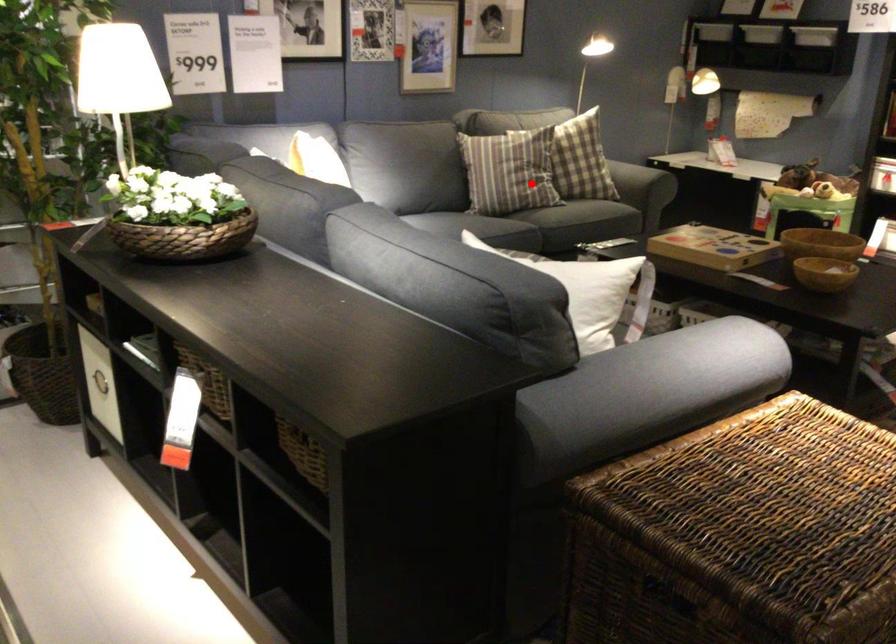
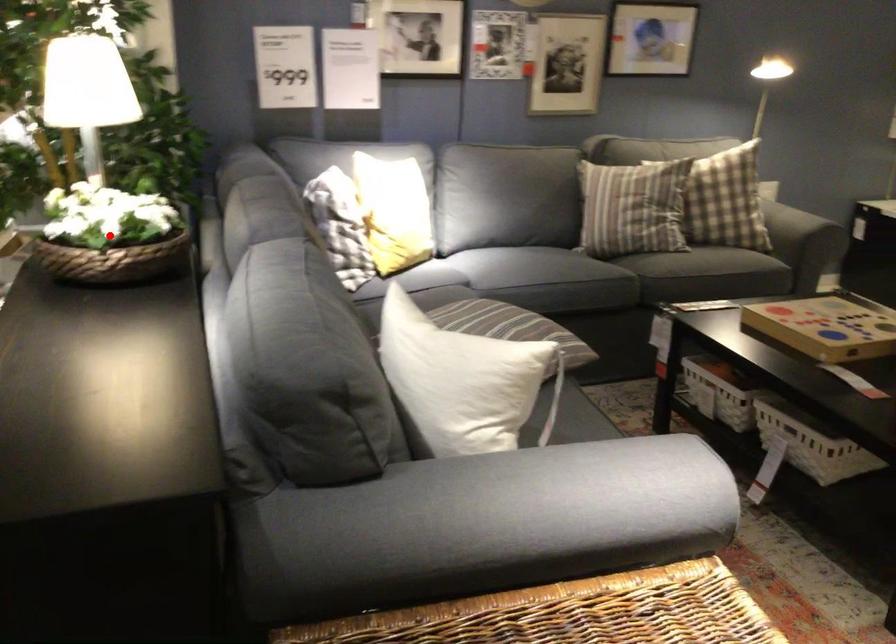
I am providing you with two images of the same scene from different viewpoints. A red point is marked on the first image and another point is marked on the second image. Are the points marked in image1 and image2 representing the same 3D position?

No